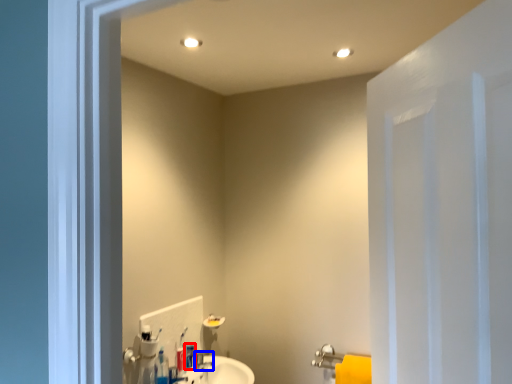
Question: Which object appears farthest to the camera in this image, toiletry (highlighted by a red box) or plumbing fixture (highlighted by a blue box)?

Choices:
 (A) toiletry
 (B) plumbing fixture

Answer: (B)